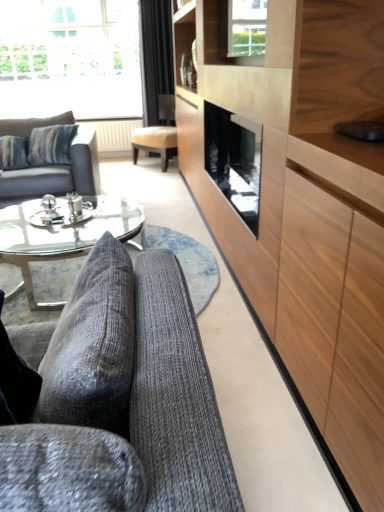
Question: Is matte gray fabric couch at left, acting as the first studio couch starting from the back, not inside black velvet curtain at upper center?

Choices:
 (A) yes
 (B) no

Answer: (A)

Question: Is matte gray fabric couch at left, acting as the first studio couch starting from the back, next to black velvet curtain at upper center and touching it?

Choices:
 (A) yes
 (B) no

Answer: (B)

Question: Is black velvet curtain at upper center completely or partially inside matte gray fabric couch at left, the 1th studio couch from the top?

Choices:
 (A) yes
 (B) no

Answer: (B)

Question: Can you confirm if matte gray fabric couch at left, the 1th studio couch from the top, is thinner than black velvet curtain at upper center?

Choices:
 (A) no
 (B) yes

Answer: (A)

Question: Does matte gray fabric couch at left, placed as the 2th studio couch when sorted from bottom to top, have a smaller size compared to black velvet curtain at upper center?

Choices:
 (A) no
 (B) yes

Answer: (A)

Question: From the image's perspective, is wooden cabinet at right located above or below matte gray fabric couch at left, the second studio couch when ordered from front to back?

Choices:
 (A) above
 (B) below

Answer: (A)

Question: Which is correct: wooden cabinet at right is inside matte gray fabric couch at left, the 1th studio couch from the top, or outside of it?

Choices:
 (A) inside
 (B) outside

Answer: (B)

Question: Is wooden cabinet at right wider or thinner than matte gray fabric couch at left, acting as the first studio couch starting from the back?

Choices:
 (A) wide
 (B) thin

Answer: (B)

Question: Is wooden cabinet at right in front of or behind matte gray fabric couch at left, the 1th studio couch from the top, in the image?

Choices:
 (A) behind
 (B) front

Answer: (B)

Question: Considering the positions of clear glass window at upper center, which is counted as the 1th window, starting from the front, and textured gray fabric couch at lower left, which is the first studio couch in bottom-to-top order, in the image, is clear glass window at upper center, which is counted as the 1th window, starting from the front, taller or shorter than textured gray fabric couch at lower left, which is the first studio couch in bottom-to-top order,?

Choices:
 (A) tall
 (B) short

Answer: (A)

Question: From a real-world perspective, is clear glass window at upper center, which ranks as the 1th window in right-to-left order, above or below textured gray fabric couch at lower left, which is the 1th studio couch from right to left?

Choices:
 (A) below
 (B) above

Answer: (B)

Question: Considering their positions, is clear glass window at upper center, which is the first window from bottom to top, located in front of or behind textured gray fabric couch at lower left, the 2th studio couch viewed from the back?

Choices:
 (A) front
 (B) behind

Answer: (B)

Question: From the image's perspective, relative to textured gray fabric couch at lower left, the 2th studio couch viewed from the back, is clear glass window at upper center, which is counted as the 1th window, starting from the front, above or below?

Choices:
 (A) below
 (B) above

Answer: (B)

Question: From their relative heights in the image, would you say beige fabric chair at center is taller or shorter than black velvet curtain at upper center?

Choices:
 (A) tall
 (B) short

Answer: (B)

Question: From a real-world perspective, is beige fabric chair at center physically located above or below black velvet curtain at upper center?

Choices:
 (A) above
 (B) below

Answer: (B)